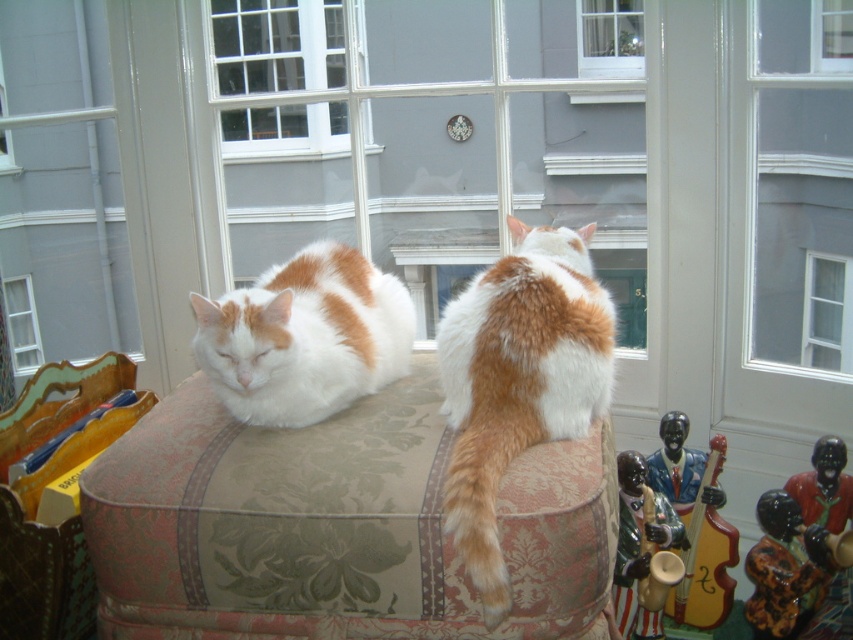
Question: Among these points, which one is nearest to the camera?

Choices:
 (A) (840, 477)
 (B) (776, 621)

Answer: (B)

Question: Estimate the real-world distances between objects in this image. Which object is farther from the red glossy figurine at lower right?

Choices:
 (A) porcelain black man at lower right
 (B) white soft cushion at center
 (C) patterned fabric chair at lower left

Answer: (C)

Question: Is patterned fabric chair at lower left closer to the viewer compared to wooden violin at lower right?

Choices:
 (A) no
 (B) yes

Answer: (B)

Question: Is transparent glass window at center above orange and white fur at upper center?

Choices:
 (A) no
 (B) yes

Answer: (B)

Question: Which of the following is the farthest from the observer?

Choices:
 (A) (833, 326)
 (B) (28, 278)
 (C) (10, 412)
 (D) (219, 77)

Answer: (B)

Question: Is white glass window at upper center further to the viewer compared to wooden violin at lower right?

Choices:
 (A) no
 (B) yes

Answer: (B)